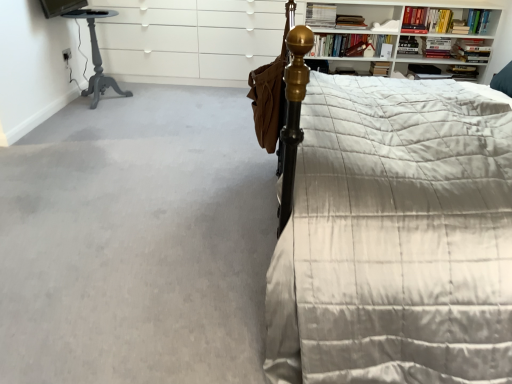
Measure the distance between hardcover book at upper right, positioned as the sixth book in right-to-left order, and camera.

The distance of hardcover book at upper right, positioned as the sixth book in right-to-left order, from camera is 4.09 meters.

The image size is (512, 384). I want to click on hardcover book at upper center, which is the 1th book in left-to-right order, so click(320, 15).

What is the approximate height of hardcover book at upper right, which is counted as the first book, starting from the right?

hardcover book at upper right, which is counted as the first book, starting from the right, is 23.36 centimeters in height.

Measure the distance between point (101, 15) and camera.

Point (101, 15) is 3.95 meters from camera.

What is the approximate width of hardcover book at upper right, which is the fifth book in left-to-right order?

hardcover book at upper right, which is the fifth book in left-to-right order, is 6.72 inches in width.

Image resolution: width=512 pixels, height=384 pixels. I want to click on hardcover book at upper right, positioned as the sixth book in right-to-left order, so click(408, 46).

From the image's perspective, count 3rd books downward from the hardcover book at upper right, which is counted as the first book, starting from the right, and point to it. Please provide its 2D coordinates.

[(408, 46)]

Based on the photo, between hardcover book at upper right, positioned as the sixth book in right-to-left order, and hardcover book at upper right, which is counted as the first book, starting from the right, which one is positioned behind?

hardcover book at upper right, positioned as the sixth book in right-to-left order, is behind.

Is hardcover book at upper right, which ranks as the 3th book in left-to-right order, taller or shorter than hardcover book at upper right, marked as the eighth book in a left-to-right arrangement?

Clearly, hardcover book at upper right, which ranks as the 3th book in left-to-right order, is shorter compared to hardcover book at upper right, marked as the eighth book in a left-to-right arrangement.

From a real-world perspective, which object stands above the other?

hardcover book at upper right, which is counted as the first book, starting from the right.

Which is correct: hardcover book at upper right, marked as the 6th book in a left-to-right arrangement, is inside hardcover book at upper center, which ranks as the eighth book in right-to-left order, or outside of it?

The correct answer is: outside.

Looking at this image, does hardcover book at upper right, the third book in the right-to-left sequence, have a smaller size compared to hardcover book at upper center, which is the 1th book in left-to-right order?

Correct, hardcover book at upper right, the third book in the right-to-left sequence, occupies less space than hardcover book at upper center, which is the 1th book in left-to-right order.

From the image's perspective, which is above, hardcover book at upper right, the third book in the right-to-left sequence, or hardcover book at upper center, which is the 1th book in left-to-right order?

From the image's view, hardcover book at upper center, which is the 1th book in left-to-right order, is above.

Is hardcover book at upper right, marked as the 6th book in a left-to-right arrangement, further to camera compared to hardcover book at upper center, which ranks as the eighth book in right-to-left order?

No, it is in front of hardcover book at upper center, which ranks as the eighth book in right-to-left order.

From a real-world perspective, is matte gray table at left positioned over hardcover book at upper right, arranged as the second book when viewed from the right, based on gravity?

No, from a real-world perspective, matte gray table at left is not above hardcover book at upper right, arranged as the second book when viewed from the right.

I want to click on the 7th book to the right when counting from the matte gray table at left, so click(471, 50).

Is matte gray table at left inside or outside of hardcover book at upper right, arranged as the second book when viewed from the right?

matte gray table at left exists outside the volume of hardcover book at upper right, arranged as the second book when viewed from the right.

In the image, is hardcover book at upper right, acting as the 4th book starting from the left, on the left side or the right side of hardcover book at upper right, which is the seventh book in left-to-right order?

Clearly, hardcover book at upper right, acting as the 4th book starting from the left, is on the left of hardcover book at upper right, which is the seventh book in left-to-right order, in the image.

Is hardcover book at upper right, positioned as the 5th book in right-to-left order, oriented towards hardcover book at upper right, which is the seventh book in left-to-right order?

No, hardcover book at upper right, positioned as the 5th book in right-to-left order, is not turned towards hardcover book at upper right, which is the seventh book in left-to-right order.

Looking at this image, is hardcover book at upper right, arranged as the second book when viewed from the right, located within hardcover book at upper right, positioned as the 5th book in right-to-left order?

No.

Which is more to the left, hardcover book at upper right, which is counted as the first book, starting from the right, or gray carpet at lower left?

gray carpet at lower left is more to the left.

From a real-world perspective, between hardcover book at upper right, which is counted as the first book, starting from the right, and gray carpet at lower left, who is vertically higher?

In real-world perspective, hardcover book at upper right, which is counted as the first book, starting from the right, is above.

From the image's perspective, which is below, hardcover book at upper right, marked as the eighth book in a left-to-right arrangement, or gray carpet at lower left?

gray carpet at lower left.

Can you tell me how much hardcover book at upper center, the second book in the left-to-right sequence, and hardcover book at upper right, positioned as the 5th book in right-to-left order, differ in facing direction?

The angle between the facing direction of hardcover book at upper center, the second book in the left-to-right sequence, and the facing direction of hardcover book at upper right, positioned as the 5th book in right-to-left order, is 1.64 degrees.

Is hardcover book at upper center, the second book in the left-to-right sequence, thinner than hardcover book at upper right, acting as the 4th book starting from the left?

No.

Who is shorter, hardcover book at upper center, the 7th book positioned from the right, or hardcover book at upper right, positioned as the 5th book in right-to-left order?

With less height is hardcover book at upper center, the 7th book positioned from the right.

Which object is positioned more to the right, hardcover book at upper center, the second book in the left-to-right sequence, or hardcover book at upper right, positioned as the 5th book in right-to-left order?

Positioned to the right is hardcover book at upper right, positioned as the 5th book in right-to-left order.

Is hardcover book at upper right, marked as the 6th book in a left-to-right arrangement, surrounded by hardcover book at upper right, arranged as the second book when viewed from the right?

No.

In terms of width, does hardcover book at upper right, which is the seventh book in left-to-right order, look wider or thinner when compared to hardcover book at upper right, the third book in the right-to-left sequence?

Considering their sizes, hardcover book at upper right, which is the seventh book in left-to-right order, looks broader than hardcover book at upper right, the third book in the right-to-left sequence.

Consider the image. From a real-world perspective, which is physically above, hardcover book at upper right, arranged as the second book when viewed from the right, or hardcover book at upper right, marked as the 6th book in a left-to-right arrangement?

From a 3D spatial view, hardcover book at upper right, marked as the 6th book in a left-to-right arrangement, is above.

Is hardcover book at upper right, arranged as the second book when viewed from the right, with hardcover book at upper right, marked as the 6th book in a left-to-right arrangement?

No, hardcover book at upper right, arranged as the second book when viewed from the right, is not in contact with hardcover book at upper right, marked as the 6th book in a left-to-right arrangement.

You are a GUI agent. You are given a task and a screenshot of the screen. Output one action in this format:
    pyautogui.click(x=<x>, y=<y>)
    Task: Click on the 6th book located above the hardcover book at upper right, positioned as the sixth book in right-to-left order (from a real-world perspective)
    The image size is (512, 384).
    Given the screenshot: What is the action you would take?
    pyautogui.click(x=478, y=21)

Starting from the hardcover book at upper center, which ranks as the eighth book in right-to-left order, which book is the 5th one to the right? Please provide its 2D coordinates.

[(459, 27)]

When comparing their distances from hardcover book at upper right, acting as the 4th book starting from the left, does hardcover book at upper right, positioned as the sixth book in right-to-left order, or matte gold bedpost at upper right seem further?

matte gold bedpost at upper right.

Which object lies nearer to the anchor point hardcover book at upper center, which ranks as the eighth book in right-to-left order, gray carpet at lower left or matte gold bedpost at upper right?

gray carpet at lower left is positioned closer to the anchor hardcover book at upper center, which ranks as the eighth book in right-to-left order.

When comparing their distances from hardcover book at upper center, which is the 1th book in left-to-right order, does hardcover book at upper right, marked as the eighth book in a left-to-right arrangement, or hardcover book at upper right, the third book in the right-to-left sequence, seem closer?

Based on the image, hardcover book at upper right, the third book in the right-to-left sequence, appears to be nearer to hardcover book at upper center, which is the 1th book in left-to-right order.

Estimate the real-world distances between objects in this image. Which object is closer to hardcover book at upper right, positioned as the fourth book in right-to-left order, hardcover book at upper right, acting as the 4th book starting from the left, or hardcover book at upper right, which is counted as the first book, starting from the right?

Among the two, hardcover book at upper right, acting as the 4th book starting from the left, is located nearer to hardcover book at upper right, positioned as the fourth book in right-to-left order.

From the image, which object appears to be farther from hardcover book at upper right, acting as the 4th book starting from the left, hardcover book at upper right, the third book in the right-to-left sequence, or matte gray table at left?

matte gray table at left is further to hardcover book at upper right, acting as the 4th book starting from the left.

When comparing their distances from matte gold bedpost at upper right, does hardcover book at upper center, the second book in the left-to-right sequence, or hardcover book at upper right, positioned as the sixth book in right-to-left order, seem closer?

Among the two, hardcover book at upper center, the second book in the left-to-right sequence, is located nearer to matte gold bedpost at upper right.

Looking at the image, which one is located further to hardcover book at upper right, positioned as the sixth book in right-to-left order, hardcover book at upper center, which is the 1th book in left-to-right order, or matte gold bedpost at upper right?

matte gold bedpost at upper right is further to hardcover book at upper right, positioned as the sixth book in right-to-left order.

Estimate the real-world distances between objects in this image. Which object is closer to hardcover book at upper right, arranged as the second book when viewed from the right, gray carpet at lower left or hardcover book at upper right, marked as the eighth book in a left-to-right arrangement?

hardcover book at upper right, marked as the eighth book in a left-to-right arrangement, is closer to hardcover book at upper right, arranged as the second book when viewed from the right.

Locate an element on the screen. This screenshot has height=384, width=512. table between matte gold bedpost at upper right and hardcover book at upper right, which is the fifth book in left-to-right order, from front to back is located at coordinates (96, 56).

Where is `table between matte gold bedpost at upper right and white matte cabinet at upper center along the z-axis`? The height and width of the screenshot is (384, 512). table between matte gold bedpost at upper right and white matte cabinet at upper center along the z-axis is located at coordinates (96, 56).

Where is `book between matte gold bedpost at upper right and hardcover book at upper right, marked as the 6th book in a left-to-right arrangement, from front to back`? This screenshot has height=384, width=512. book between matte gold bedpost at upper right and hardcover book at upper right, marked as the 6th book in a left-to-right arrangement, from front to back is located at coordinates 443,21.

The image size is (512, 384). Find the location of `entertainment center between matte gold bedpost at upper right and hardcover book at upper center, which ranks as the eighth book in right-to-left order, along the z-axis`. entertainment center between matte gold bedpost at upper right and hardcover book at upper center, which ranks as the eighth book in right-to-left order, along the z-axis is located at coordinates (185, 40).